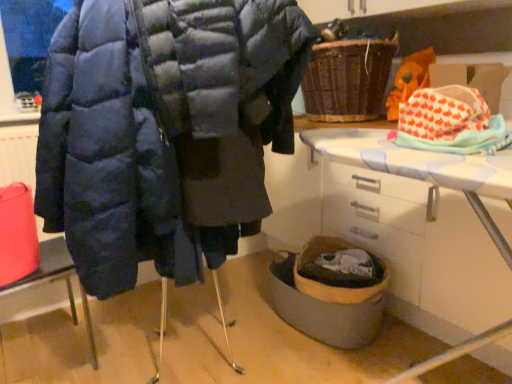
What are the coordinates of `free space underneath matte blue puffer jacket at center (from a real-world perspective)` in the screenshot? It's located at (204, 350).